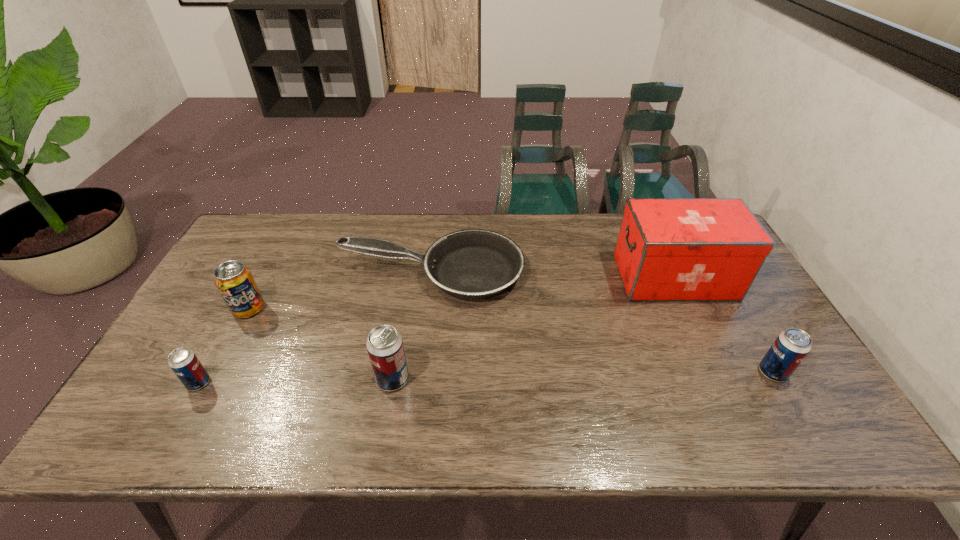
Where is `the first-aid kit located at the right edge`? This screenshot has width=960, height=540. the first-aid kit located at the right edge is located at coordinates (668, 249).

You are a GUI agent. You are given a task and a screenshot of the screen. Output one action in this format:
    pyautogui.click(x=<x>, y=<y>)
    Task: Click on the object that is at the near left corner
    This screenshot has height=540, width=960.
    Given the screenshot: What is the action you would take?
    pyautogui.click(x=184, y=363)

You are a GUI agent. You are given a task and a screenshot of the screen. Output one action in this format:
    pyautogui.click(x=<x>, y=<y>)
    Task: Click on the object that is positioned at the far right corner
    This screenshot has width=960, height=540.
    Given the screenshot: What is the action you would take?
    pyautogui.click(x=668, y=249)

Find the location of a particular element. object present at the near right corner is located at coordinates (791, 346).

I want to click on free space at the far edge of the desktop, so click(x=541, y=217).

This screenshot has width=960, height=540. In the image, there is a desktop. Find the location of `free space at the near edge`. free space at the near edge is located at coordinates (680, 404).

This screenshot has height=540, width=960. What are the coordinates of `blank area at the near right corner` in the screenshot? It's located at (783, 396).

This screenshot has height=540, width=960. Identify the location of free area in between the shortest beer can and the soda can. (224, 346).

Identify the location of free point between the second tallest beer can and the frying pan. The image size is (960, 540). (602, 322).

Identify the location of vacant area between the shortest beer can and the soda can. (224, 346).